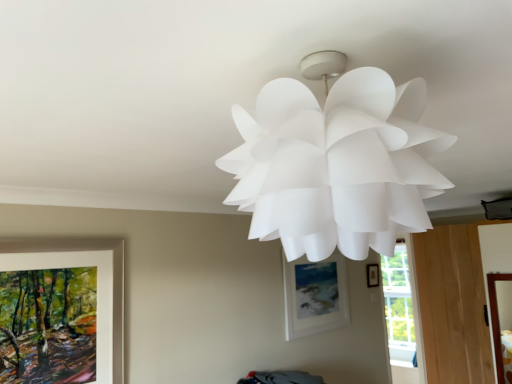
Question: Can you confirm if transparent glass window at lower right is positioned to the right of white paper lamp at upper center?

Choices:
 (A) no
 (B) yes

Answer: (B)

Question: Does transparent glass window at lower right lie behind white paper lamp at upper center?

Choices:
 (A) yes
 (B) no

Answer: (A)

Question: From a real-world perspective, does transparent glass window at lower right stand above white paper lamp at upper center?

Choices:
 (A) no
 (B) yes

Answer: (A)

Question: From a real-world perspective, does transparent glass window at lower right sit lower than white paper lamp at upper center?

Choices:
 (A) no
 (B) yes

Answer: (B)

Question: Considering the relative positions of transparent glass window at lower right and white paper lamp at upper center in the image provided, is transparent glass window at lower right to the left of white paper lamp at upper center from the viewer's perspective?

Choices:
 (A) yes
 (B) no

Answer: (B)

Question: Can you confirm if transparent glass window at lower right is thinner than white paper lamp at upper center?

Choices:
 (A) yes
 (B) no

Answer: (A)

Question: Can you confirm if white matte picture frame at center, the second picture frame viewed from the back, is bigger than matte black picture frame at center-right, which is the first picture frame from back to front?

Choices:
 (A) no
 (B) yes

Answer: (B)

Question: Does white matte picture frame at center, which is the second picture frame in right-to-left order, have a greater width compared to matte black picture frame at center-right, acting as the first picture frame starting from the right?

Choices:
 (A) yes
 (B) no

Answer: (A)

Question: From the image's perspective, would you say white matte picture frame at center, arranged as the second picture frame when viewed from the left, is shown under matte black picture frame at center-right, which is the first picture frame from back to front?

Choices:
 (A) yes
 (B) no

Answer: (A)

Question: Would you consider white matte picture frame at center, arranged as the second picture frame when viewed from the left, to be distant from matte black picture frame at center-right, acting as the first picture frame starting from the right?

Choices:
 (A) no
 (B) yes

Answer: (A)

Question: From a real-world perspective, is white matte picture frame at center, arranged as the second picture frame when viewed from the left, positioned under matte black picture frame at center-right, the 3th picture frame when ordered from front to back, based on gravity?

Choices:
 (A) no
 (B) yes

Answer: (B)

Question: Is white matte picture frame at center, the 2th picture frame viewed from the front, at the right side of matte black picture frame at center-right, acting as the first picture frame starting from the right?

Choices:
 (A) no
 (B) yes

Answer: (A)

Question: Does white matte picture frame at center, which is the second picture frame in right-to-left order, have a greater height compared to white paper lamp at upper center?

Choices:
 (A) no
 (B) yes

Answer: (B)